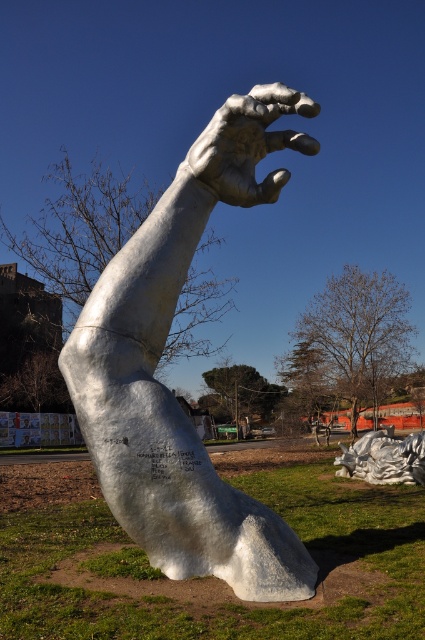
Question: Does white marble sculpture at center appear on the left side of shiny silver hand at center?

Choices:
 (A) no
 (B) yes

Answer: (B)

Question: Which of the following is the farthest from the observer?

Choices:
 (A) shiny silver hand at center
 (B) white marble hand at center

Answer: (A)

Question: Which point is farther from the camera taking this photo?

Choices:
 (A) (248, 205)
 (B) (198, 614)
 (C) (408, 444)

Answer: (C)

Question: Is white marble hand at center positioned in front of shiny silver hand at center?

Choices:
 (A) no
 (B) yes

Answer: (B)

Question: Is shiny silver hand at center above shiny silver sculpture at lower right?

Choices:
 (A) yes
 (B) no

Answer: (A)

Question: Which point is farther to the camera?

Choices:
 (A) (308, 141)
 (B) (388, 472)
 (C) (190, 582)
 (D) (243, 508)

Answer: (B)